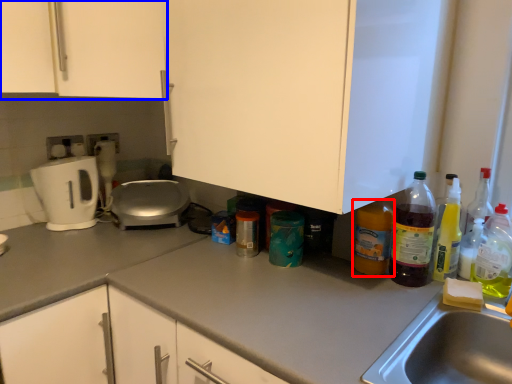
Question: Which object is closer to the camera taking this photo, bottle (highlighted by a red box) or cabinetry (highlighted by a blue box)?

Choices:
 (A) bottle
 (B) cabinetry

Answer: (A)